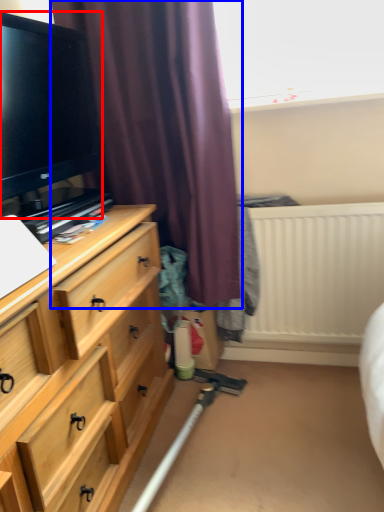
Question: Which object is closer to the camera taking this photo, television (highlighted by a red box) or curtain (highlighted by a blue box)?

Choices:
 (A) television
 (B) curtain

Answer: (A)